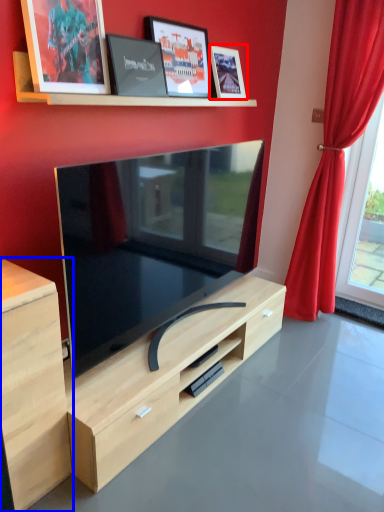
Question: Which point is closer to the camera, picture frame (highlighted by a red box) or cabinetry (highlighted by a blue box)?

Choices:
 (A) picture frame
 (B) cabinetry

Answer: (B)